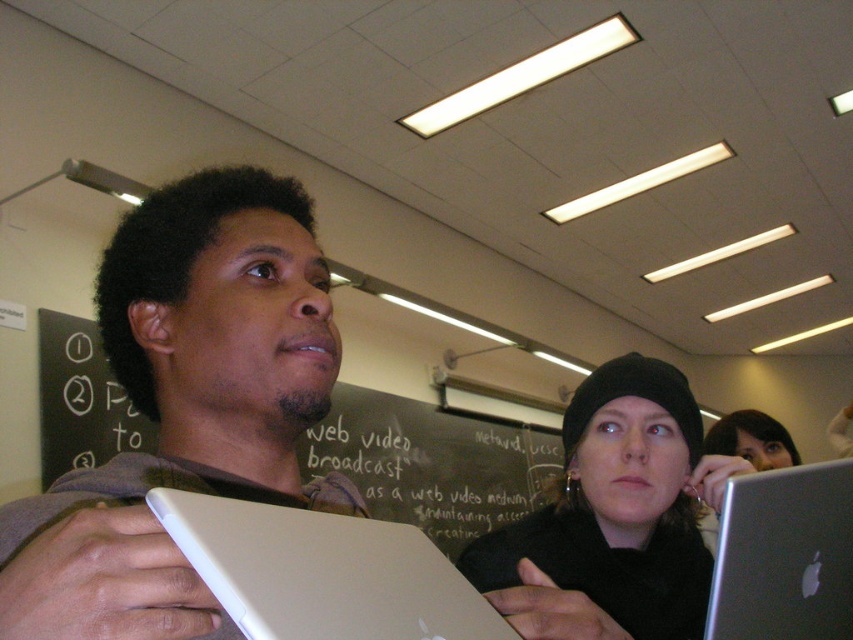
Looking at this image, you are a student in the classroom and need to write something on the black chalkboard at center. To reach it, you must walk past the silver metallic laptop at lower right. Based on their positions, will you have to move around to the left or the right of the laptop to reach the chalkboard?

The black chalkboard at center is positioned on the left side of silver metallic laptop at lower right, so you would need to move to the left of the laptop to reach the chalkboard.

You are a student in the classroom and want to show your friend the silver metallic tablet at center. However, the black matte beanie at upper center is blocking your view. Can you move the tablet forward so it is no longer behind the beanie?

The silver metallic tablet at center is currently positioned behind the black matte beanie at upper center. Moving it forward would require adjusting its placement relative to the beanie to ensure it is no longer obscured.